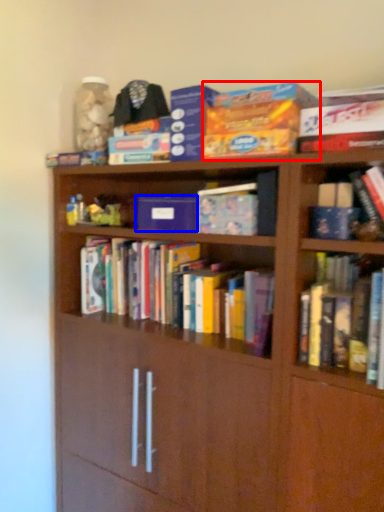
Question: Which object appears closest to the camera in this image, paperback book (highlighted by a red box) or paperback book (highlighted by a blue box)?

Choices:
 (A) paperback book
 (B) paperback book

Answer: (A)